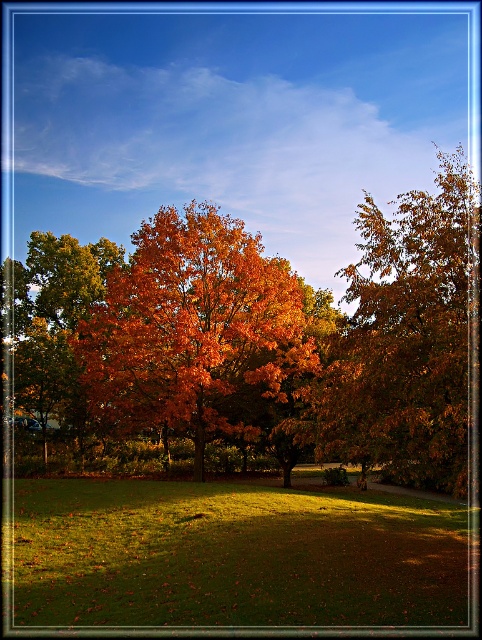
Is point (419, 545) positioned behind point (13, 317)?

No, (419, 545) is closer to viewer.

Does point (436, 602) come in front of point (72, 417)?

That is True.

Find the location of a particular element. The width and height of the screenshot is (482, 640). green grassy field at center is located at coordinates (233, 556).

Which is behind, point (270, 323) or point (339, 410)?

The point (270, 323) is behind.

Which is below, shiny orange leaves at center or golden-brown leaves at right?

Positioned lower is shiny orange leaves at center.

Is point (243, 291) less distant than point (450, 417)?

No, it is behind (450, 417).

Where is `shiny orange leaves at center`? shiny orange leaves at center is located at coordinates (193, 330).

Does golden-brown leaves at right appear on the right side of orange leafy tree at center?

Indeed, golden-brown leaves at right is positioned on the right side of orange leafy tree at center.

This screenshot has width=482, height=640. In order to click on golden-brown leaves at right in this screenshot , I will do `click(404, 340)`.